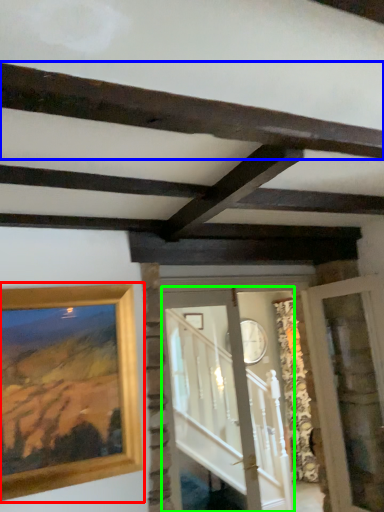
Question: Which object is the farthest from picture frame (highlighted by a red box)? Choose among these: plank (highlighted by a blue box) or glass door (highlighted by a green box).

Choices:
 (A) plank
 (B) glass door

Answer: (B)